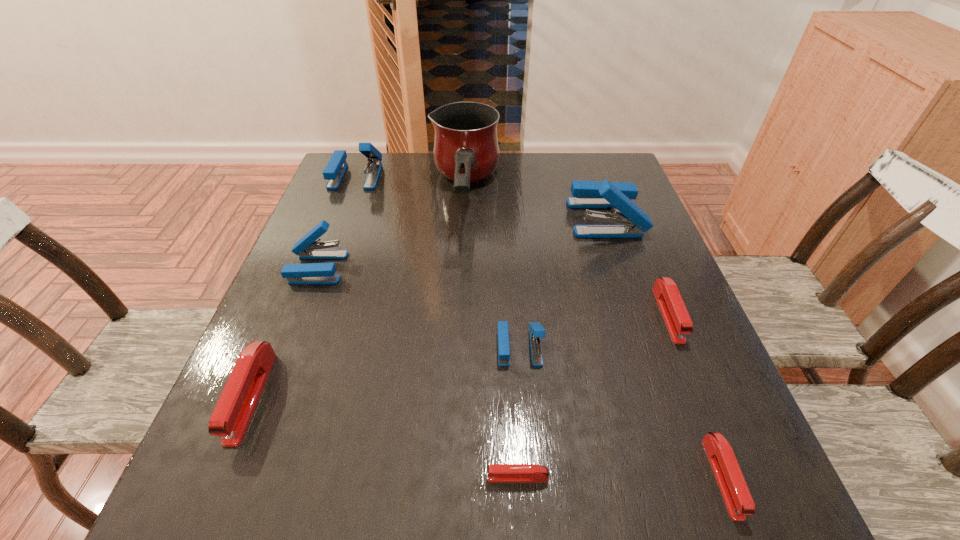
I want to click on the tallest object, so click(x=466, y=150).

Image resolution: width=960 pixels, height=540 pixels. Find the location of `the rightmost blue stapler`. the rightmost blue stapler is located at coordinates (586, 194).

At what (x,y) coordinates should I click in order to perform the action: click on the tallest stapler. Please return your answer as a coordinate pair (x, y). The height and width of the screenshot is (540, 960). Looking at the image, I should click on (586, 194).

Find the location of a particular element. the farthest blue stapler is located at coordinates (334, 171).

The image size is (960, 540). I want to click on the second biggest blue stapler, so click(334, 171).

Locate an element on the screen. This screenshot has width=960, height=540. the second smallest blue stapler is located at coordinates (307, 247).

Identify the location of the third tallest stapler. (307, 247).

You are a GUI agent. You are given a task and a screenshot of the screen. Output one action in this format:
    pyautogui.click(x=<x>, y=<y>)
    Task: Click on the third blue stapler from left to right
    The height and width of the screenshot is (540, 960).
    Given the screenshot: What is the action you would take?
    pyautogui.click(x=536, y=331)

Find the location of a particular element. This screenshot has width=960, height=540. the nearest blue stapler is located at coordinates (536, 331).

In order to click on the leftmost red stapler in this screenshot , I will do `click(235, 407)`.